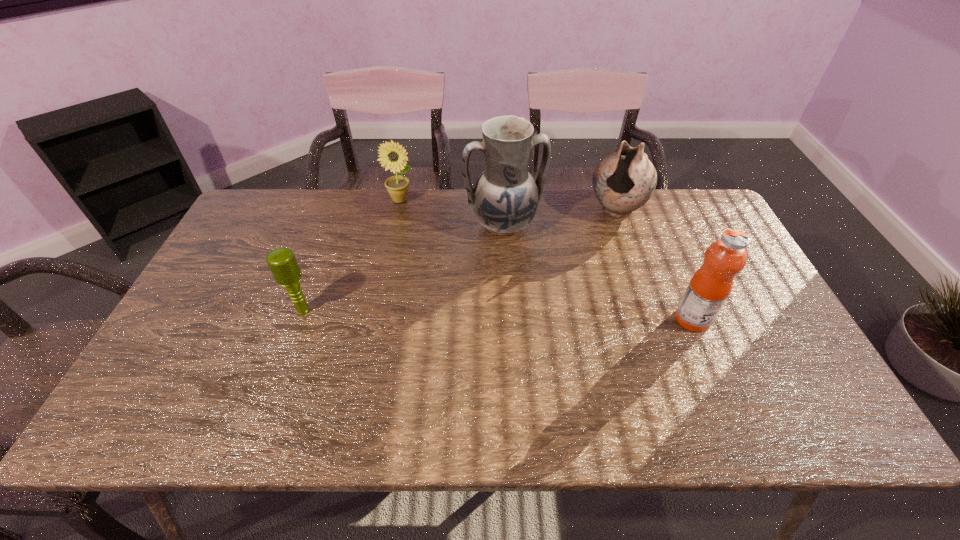
The height and width of the screenshot is (540, 960). Identify the location of free space on the desktop that is between the microphone and the fruit juice and is positioned on the front-facing side of the third object from left to right. (541, 316).

You are a GUI agent. You are given a task and a screenshot of the screen. Output one action in this format:
    pyautogui.click(x=<x>, y=<y>)
    Task: Click on the vacant spot on the desktop that is between the microphone and the fruit juice and is positioned on the face of the fourth object from right to left
    
    Given the screenshot: What is the action you would take?
    pyautogui.click(x=486, y=315)

Locate an element on the screen. This screenshot has height=540, width=960. free space on the desktop that is between the leftmost object and the fruit juice and is positioned from the spout of the pottery is located at coordinates (545, 316).